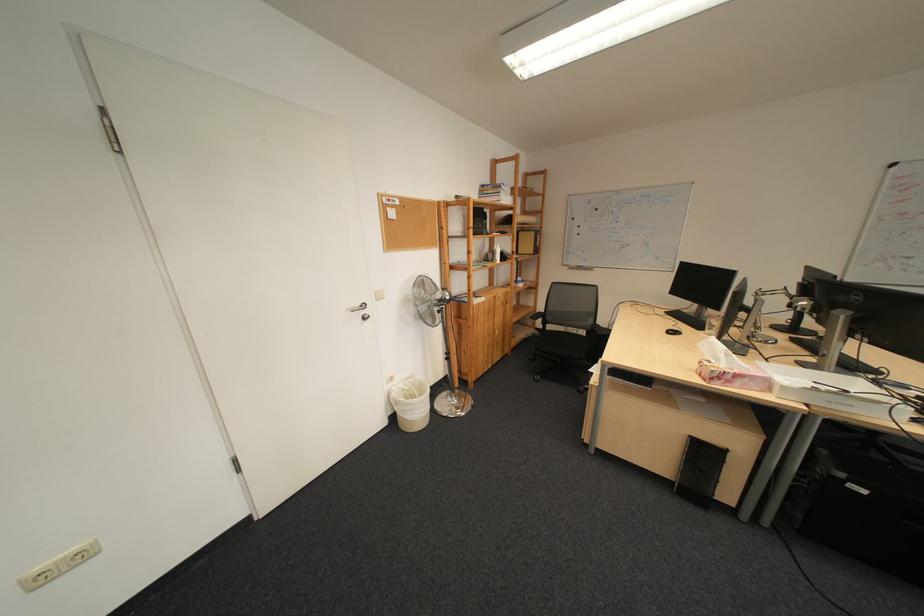
The location [673,331] corresponds to which object?

This point indicates the black computer mouse.